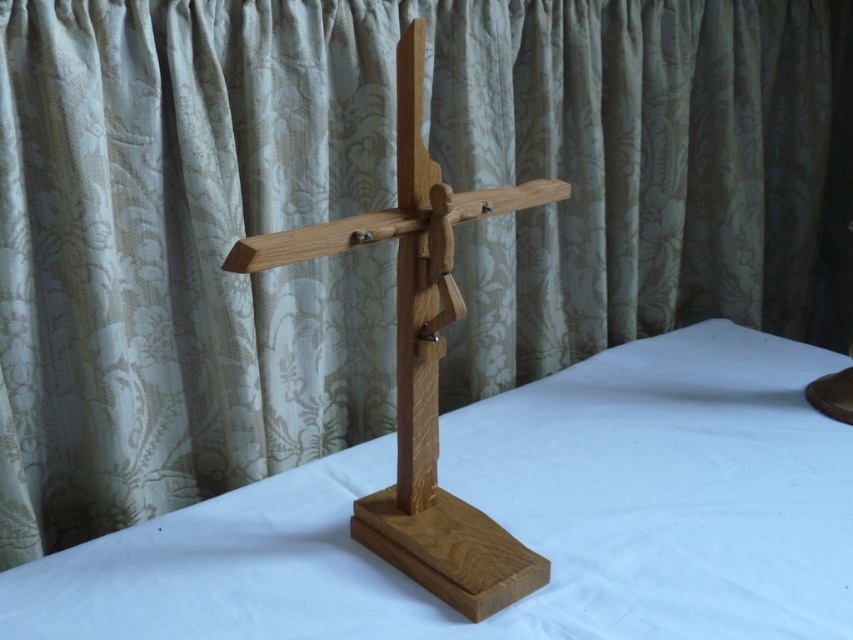
You are a painter standing in front of the natural wood table at center and the natural wood crucifix at center. You want to paint the crucifix but need to adjust your chair height. Which object is shorter so you can determine the required chair height?

The natural wood table at center is shorter than the natural wood crucifix at center, so you should adjust your chair height to match the table height to reach the crucifix.

Looking at this image, you are a delivery person who needs to place a package on the natural wood table at center. However, there is a natural wood crucifix at center in the way. Can you place the package on the table without moving the crucifix?

The distance between the natural wood table at center and natural wood crucifix at center is 10.39 inches, so there is enough space to place the package on the table without moving the crucifix.